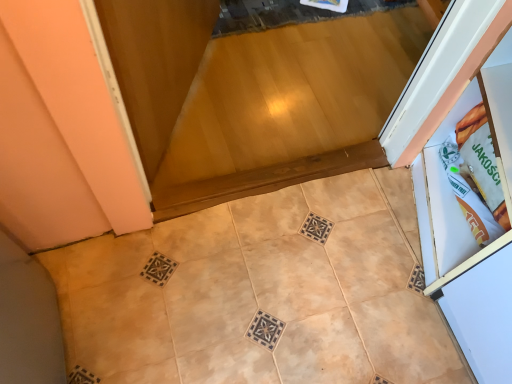
At what (x,y) coordinates should I click in order to perform the action: click on vacant space to the right of beige matte tile at center, placed as the first ceramic tile when sorted from left to right. Please return your answer as a coordinate pair (x, y). Looking at the image, I should click on (295, 331).